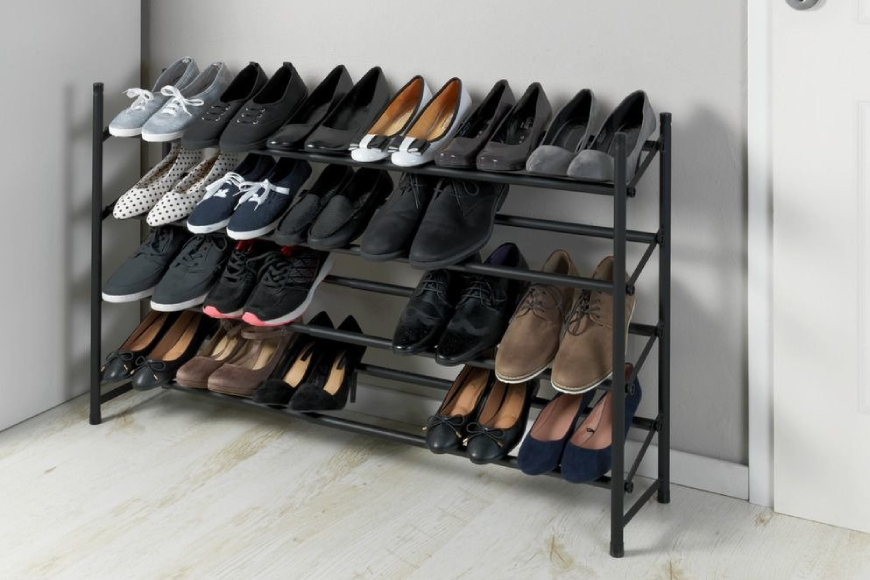
The height and width of the screenshot is (580, 870). I want to click on shoes on bottom shelf, so click(581, 445), click(546, 445), click(489, 435), click(449, 424), click(325, 385), click(291, 378), click(249, 365), click(212, 365), click(164, 364), click(135, 347).